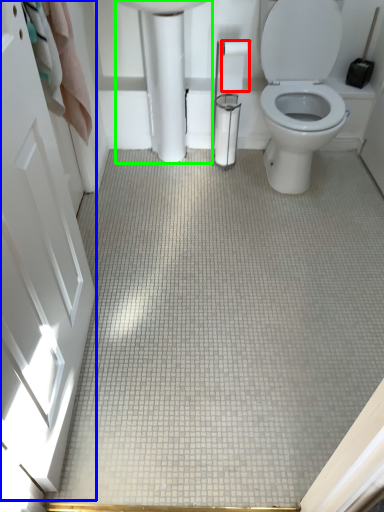
Question: Based on their relative distances, which object is nearer to toilet paper (highlighted by a red box)? Choose from screen door (highlighted by a blue box) and porcelain (highlighted by a green box).

Choices:
 (A) screen door
 (B) porcelain

Answer: (B)